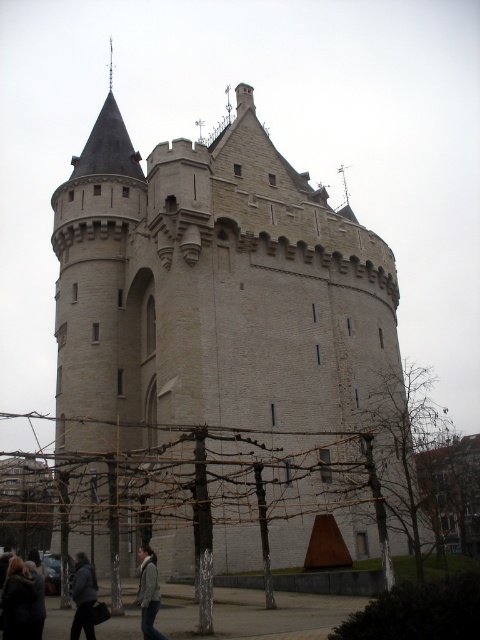
Between beige stone castle at center and dark gray jacket at lower left, which one is positioned higher?

beige stone castle at center is higher up.

Can you confirm if beige stone castle at center is positioned above dark gray jacket at lower left?

Yes, beige stone castle at center is above dark gray jacket at lower left.

The width and height of the screenshot is (480, 640). What do you see at coordinates (228, 339) in the screenshot?
I see `beige stone castle at center` at bounding box center [228, 339].

Where is `beige stone castle at center`? beige stone castle at center is located at coordinates tap(228, 339).

Is point (84, 618) farther from camera compared to point (144, 612)?

Yes.

Which is behind, point (75, 636) or point (154, 564)?

The point (154, 564) is behind.

Where is `dark gray jacket at lower left`? Image resolution: width=480 pixels, height=640 pixels. dark gray jacket at lower left is located at coordinates (84, 596).

At what (x,y) coordinates should I click in order to perform the action: click on dark gray jacket at lower left. Please return your answer as a coordinate pair (x, y). This screenshot has height=640, width=480. Looking at the image, I should click on (84, 596).

Does dark brown leather jacket at lower left appear over dark gray jacket at lower left?

Yes.

Locate an element on the screen. This screenshot has height=640, width=480. dark brown leather jacket at lower left is located at coordinates (20, 602).